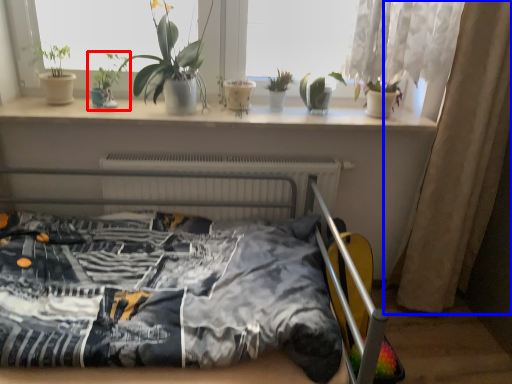
Question: Among these objects, which one is nearest to the camera, houseplant (highlighted by a red box) or curtain (highlighted by a blue box)?

Choices:
 (A) houseplant
 (B) curtain

Answer: (B)